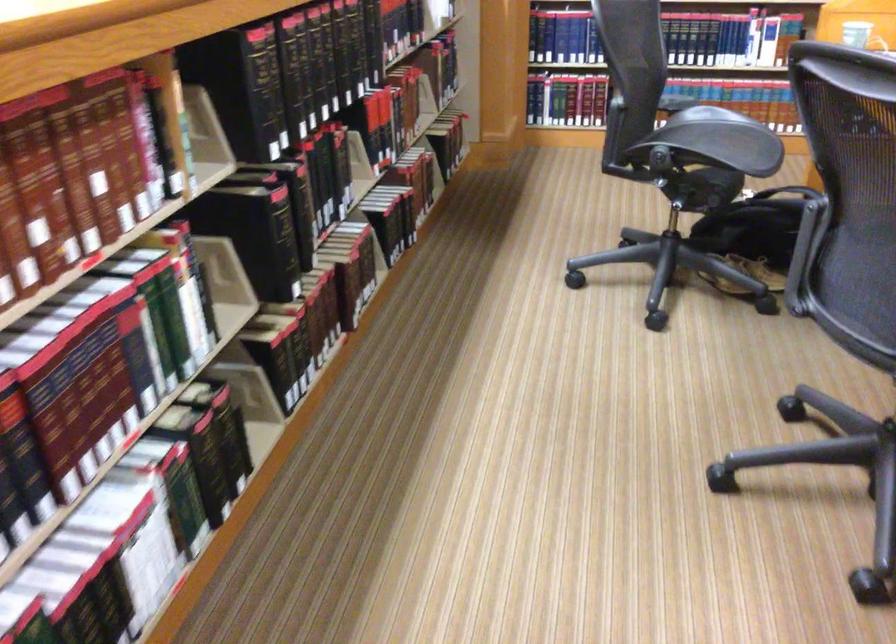
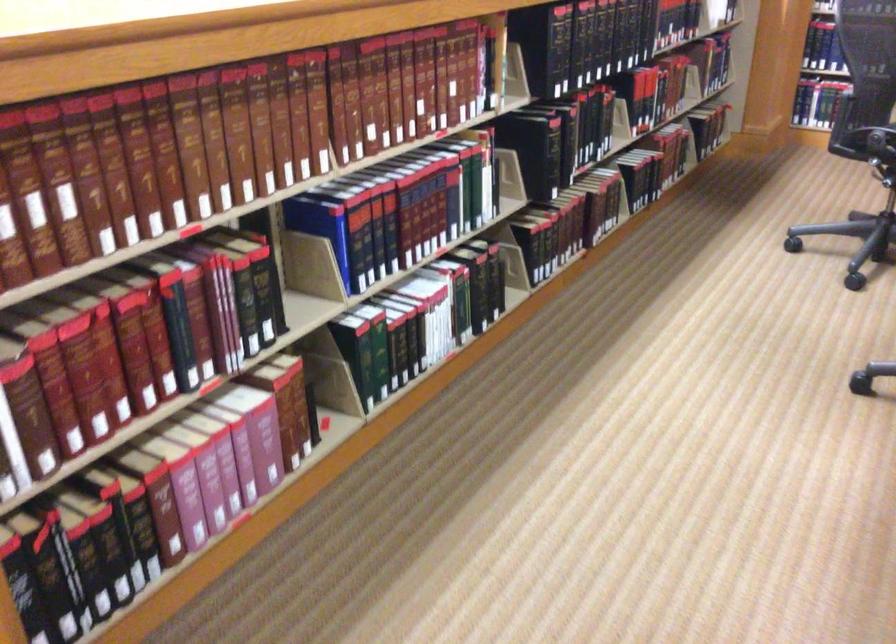
Locate, in the second image, the point that corresponds to point 242,401 in the first image.

(506, 267)